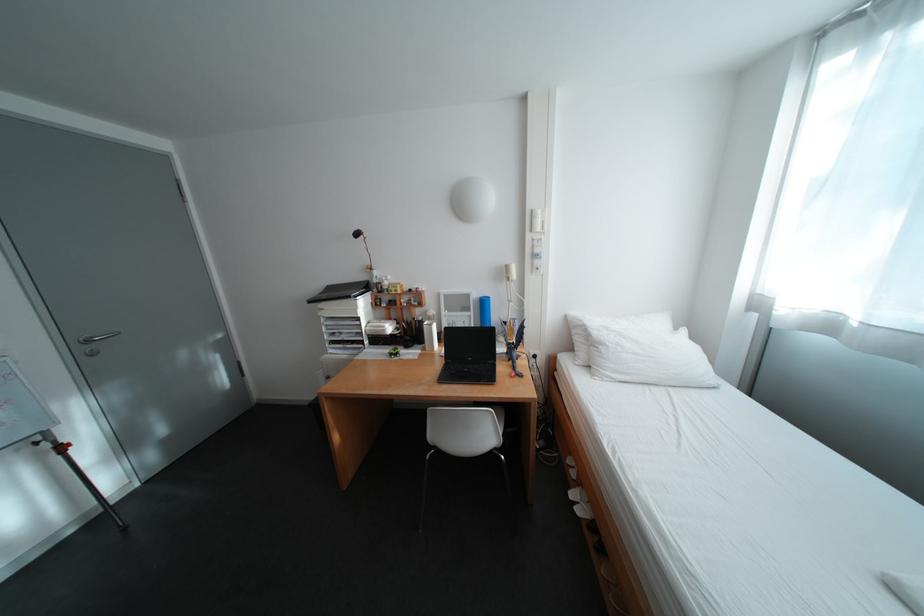
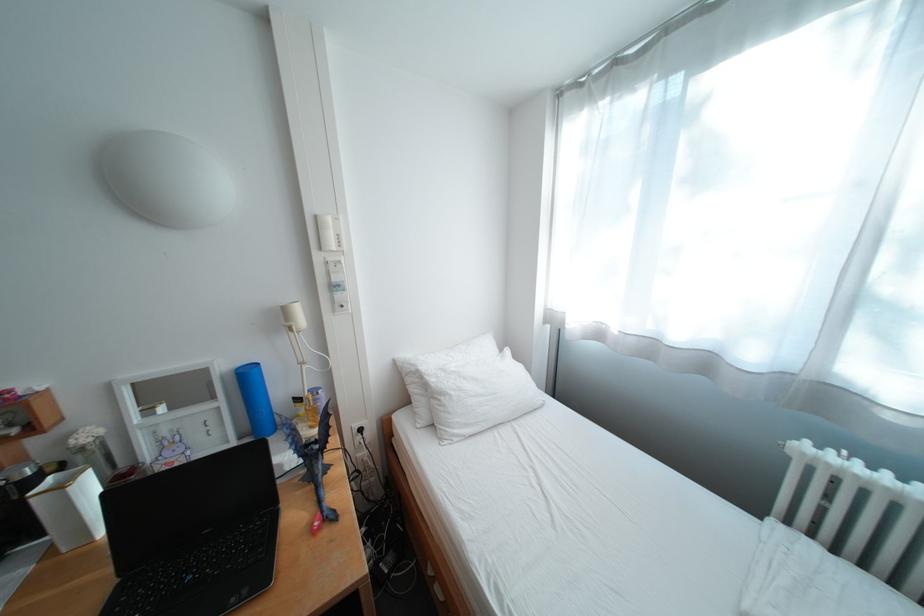
Question: Based on the continuous images, in which direction is the camera rotating? Reply with the corresponding letter.

Choices:
 (A) Left
 (B) Right
 (C) Up
 (D) Down

Answer: (B)